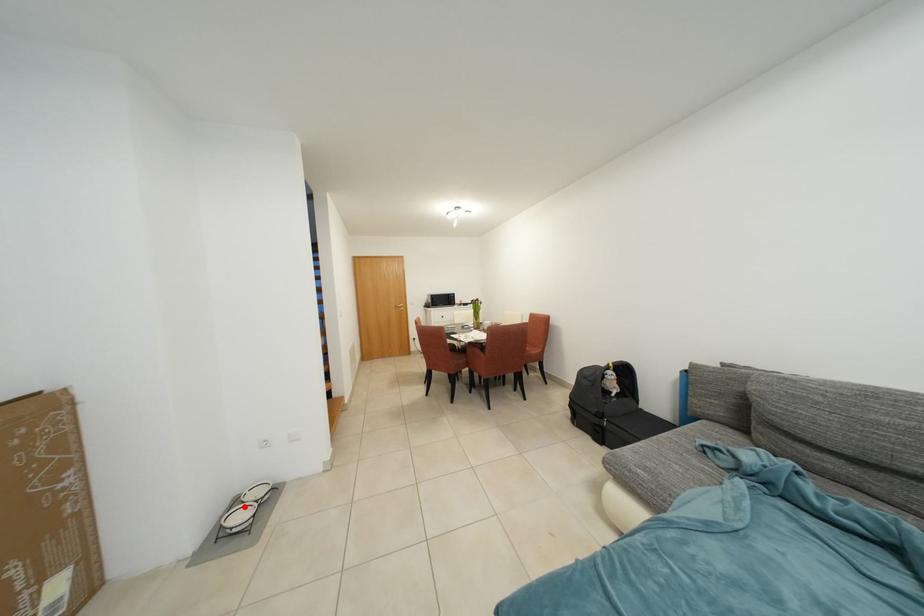
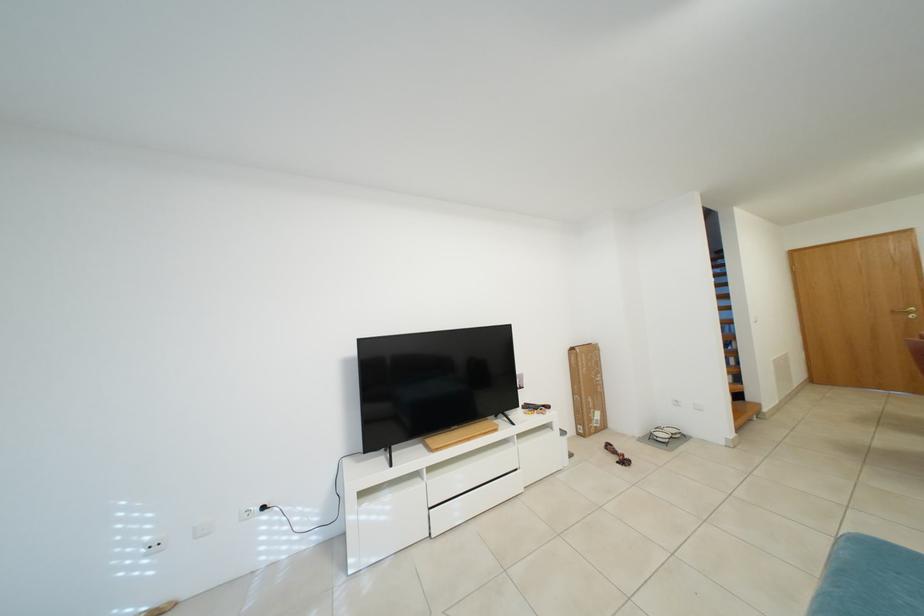
Question: I am providing you with two images of the same scene from different viewpoints. In image1, a red point is highlighted. Considering the same 3D point in image2, which of the following is correct?

Choices:
 (A) It is closer
 (B) It is farther

Answer: (B)